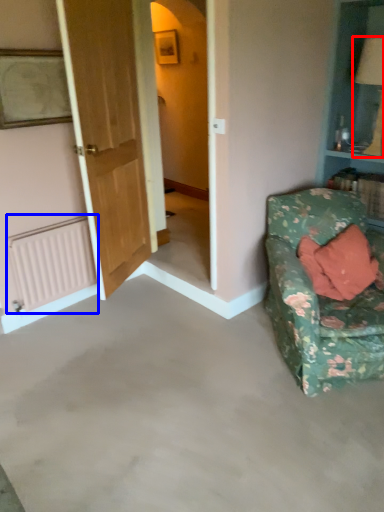
Question: Which object appears closest to the camera in this image, table lamp (highlighted by a red box) or radiator (highlighted by a blue box)?

Choices:
 (A) table lamp
 (B) radiator

Answer: (A)